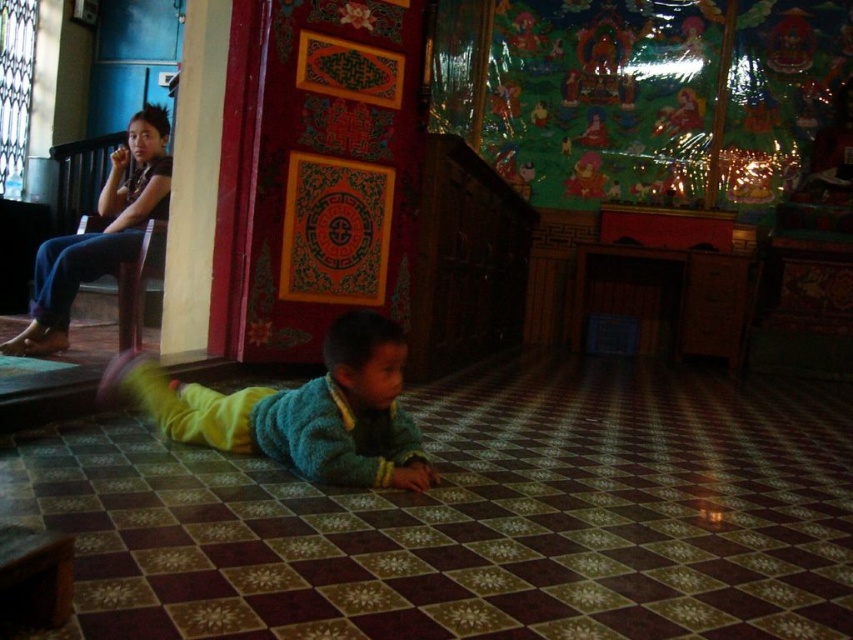
Can you confirm if knitted green sweater at center is smaller than jeans at left?

Yes, knitted green sweater at center is smaller than jeans at left.

Can you confirm if knitted green sweater at center is positioned to the right of jeans at left?

Yes, knitted green sweater at center is to the right of jeans at left.

This screenshot has height=640, width=853. Identify the location of knitted green sweater at center. (302, 410).

You are a GUI agent. You are given a task and a screenshot of the screen. Output one action in this format:
    pyautogui.click(x=<x>, y=<y>)
    Task: Click on the knitted green sweater at center
    
    Given the screenshot: What is the action you would take?
    (x=302, y=410)